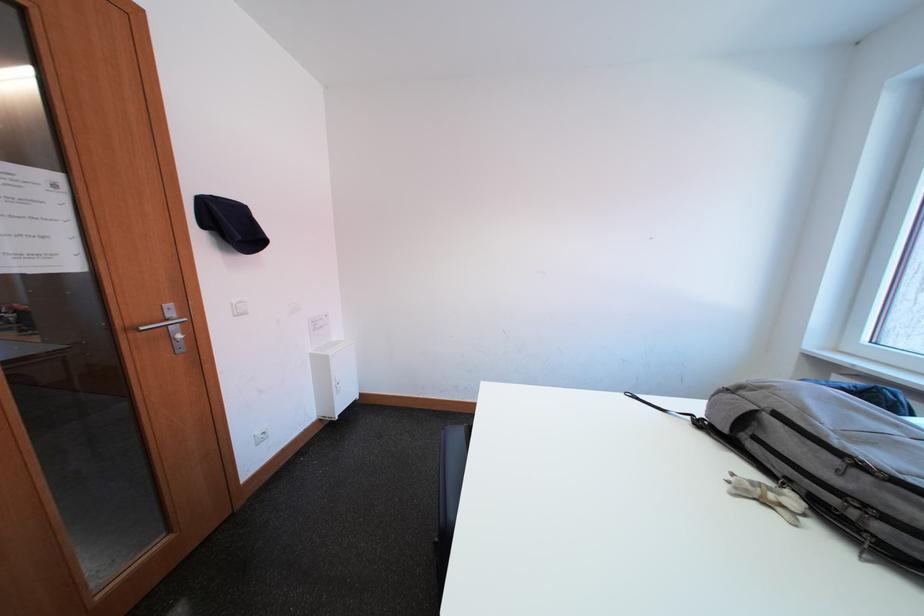
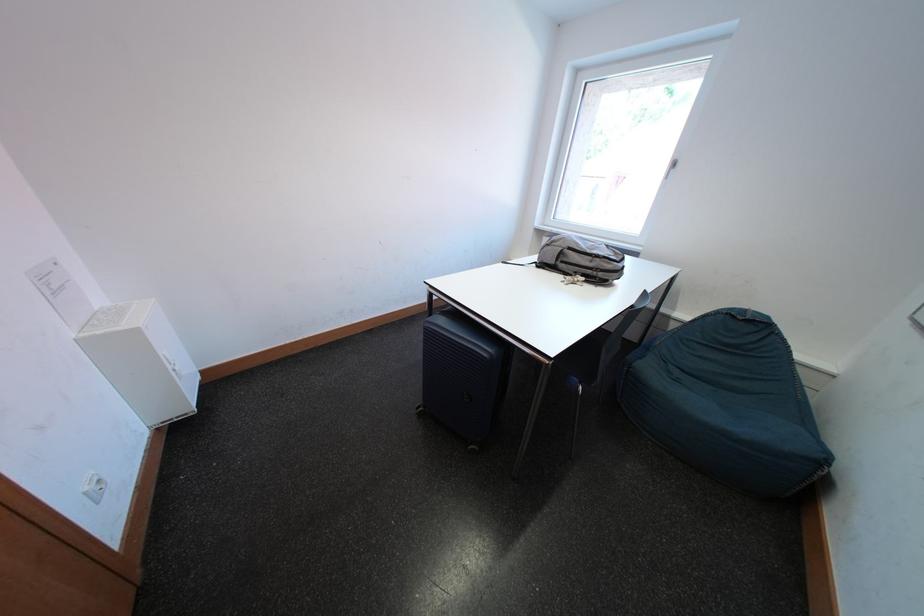
The point at (849, 476) is marked in the first image. Where is the corresponding point in the second image?

(601, 265)